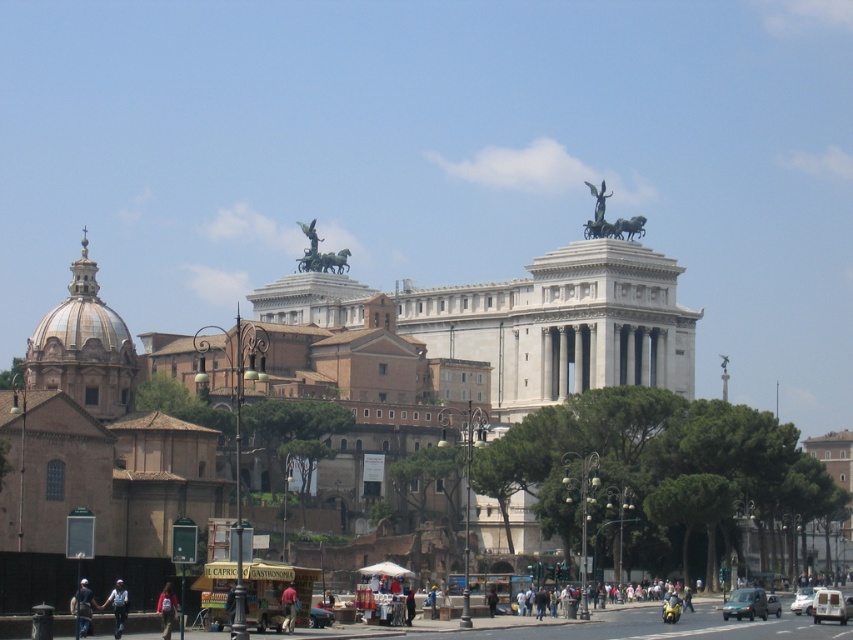
Question: Does light brown leather jacket at lower center have a lesser width compared to bronze statue at upper center?

Choices:
 (A) yes
 (B) no

Answer: (B)

Question: Which of the following is the farthest from the observer?

Choices:
 (A) (611, 600)
 (B) (619, 224)
 (C) (837, 609)
 (D) (733, 609)

Answer: (B)

Question: Which point is farther to the camera?

Choices:
 (A) white matte van at lower right
 (B) pink fabric shirt at lower center
 (C) white glossy car at center
 (D) light brown leather jacket at lower center

Answer: (C)

Question: Which of the following is the farthest from the observer?

Choices:
 (A) green matte van at center
 (B) dark gray jacket at lower left
 (C) white matte van at lower right
 (D) pink fabric shirt at lower center

Answer: (A)

Question: Does green matte van at center appear on the right side of light blue jeans at lower left?

Choices:
 (A) yes
 (B) no

Answer: (A)

Question: Can you confirm if polished bronze statue at upper center is positioned below dark gray jacket at lower left?

Choices:
 (A) yes
 (B) no

Answer: (B)